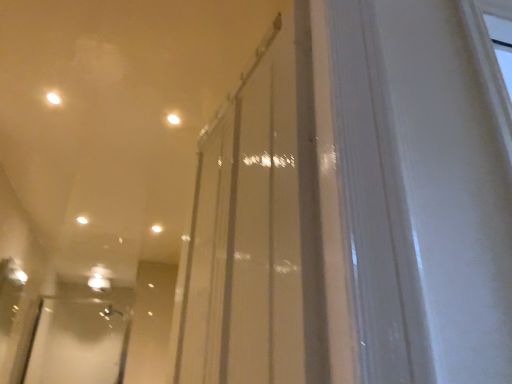
Question: Does white glossy light at center, the 1th light in the bottom-to-top sequence, have a greater height compared to matte white light at upper center, which ranks as the 1th light in top-to-bottom order?

Choices:
 (A) no
 (B) yes

Answer: (B)

Question: Is white glossy light at center, the third light from the front, located outside matte white light at upper center, the 3th light in the back-to-front sequence?

Choices:
 (A) yes
 (B) no

Answer: (A)

Question: Considering the relative sizes of white glossy light at center, arranged as the 2th light when viewed from the left, and matte white light at upper center, which is counted as the 1th light, starting from the right, in the image provided, is white glossy light at center, arranged as the 2th light when viewed from the left, wider than matte white light at upper center, which is counted as the 1th light, starting from the right,?

Choices:
 (A) no
 (B) yes

Answer: (B)

Question: Does white glossy light at center, the third light from the front, appear on the left side of matte white light at upper center, which is the 3th light in bottom-to-top order?

Choices:
 (A) no
 (B) yes

Answer: (B)

Question: Does white glossy light at center, arranged as the 2th light when viewed from the left, have a larger size compared to matte white light at upper center, which ranks as the 1th light in top-to-bottom order?

Choices:
 (A) yes
 (B) no

Answer: (A)

Question: From a real-world perspective, is white glossy light at center, the 1th light in the bottom-to-top sequence, below matte white light at upper center, which appears as the third light when viewed from the left?

Choices:
 (A) no
 (B) yes

Answer: (A)

Question: Is transparent glass door at center further to camera compared to clear plastic screen door at lower left?

Choices:
 (A) no
 (B) yes

Answer: (A)

Question: From the image's perspective, is transparent glass door at center under clear plastic screen door at lower left?

Choices:
 (A) no
 (B) yes

Answer: (A)

Question: Can you confirm if transparent glass door at center is shorter than clear plastic screen door at lower left?

Choices:
 (A) no
 (B) yes

Answer: (A)

Question: Is transparent glass door at center looking in the opposite direction of clear plastic screen door at lower left?

Choices:
 (A) no
 (B) yes

Answer: (A)

Question: From the image's perspective, is transparent glass door at center on clear plastic screen door at lower left?

Choices:
 (A) yes
 (B) no

Answer: (A)

Question: Can you confirm if transparent glass door at center is positioned to the left of clear plastic screen door at lower left?

Choices:
 (A) yes
 (B) no

Answer: (B)

Question: From the image's perspective, does transparent glass door at center appear higher than white glossy light at center, the third light from the front?

Choices:
 (A) yes
 (B) no

Answer: (A)